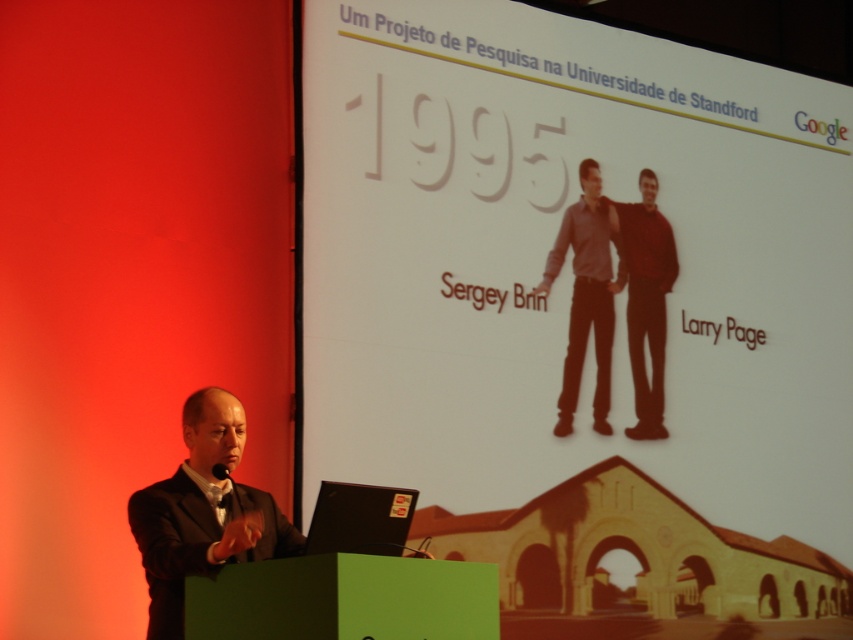
Can you confirm if black suit at left is positioned to the right of dark red sweater at center?

No, black suit at left is not to the right of dark red sweater at center.

Between point (265, 502) and point (637, 422), which one is positioned in front?

Point (265, 502)

Between point (293, 552) and point (627, 333), which one is positioned behind?

Positioned behind is point (627, 333).

The image size is (853, 640). I want to click on black suit at left, so tap(202, 513).

Which is more to the left, gray matte shirt at center or black matte laptop at lower center?

black matte laptop at lower center is more to the left.

Is point (598, 385) closer to camera compared to point (380, 529)?

No, (598, 385) is behind (380, 529).

You are a GUI agent. You are given a task and a screenshot of the screen. Output one action in this format:
    pyautogui.click(x=<x>, y=<y>)
    Task: Click on the gray matte shirt at center
    
    Given the screenshot: What is the action you would take?
    pyautogui.click(x=585, y=296)

Who is lower down, dark red sweater at center or black matte laptop at lower center?

black matte laptop at lower center is below.

Is point (641, 284) behind point (334, 531)?

That is True.

Identify the location of dark red sweater at center. Image resolution: width=853 pixels, height=640 pixels. (645, 298).